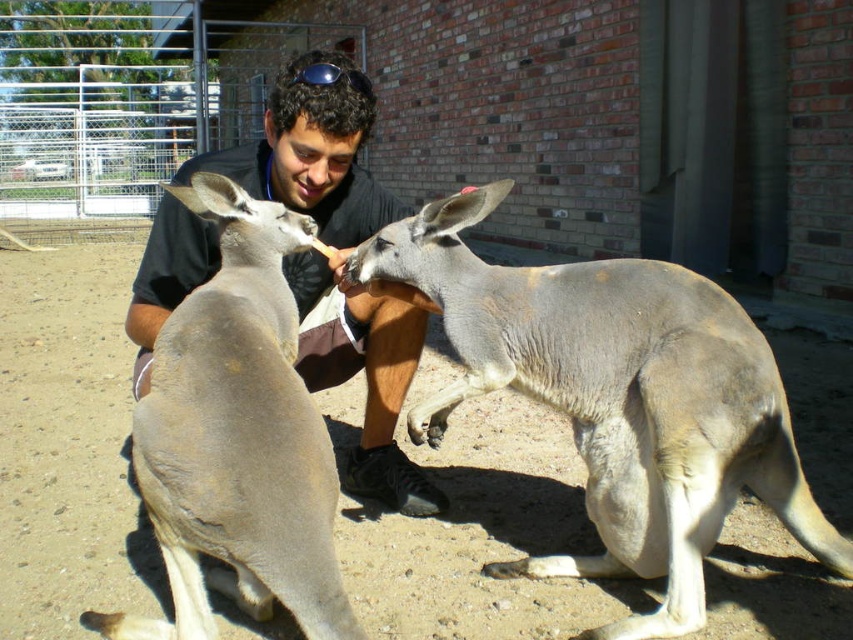
You are a wildlife photographer trying to capture a photo of both the gray fur kangaroo at center and the gray matte kangaroo at center. Your camera has a focus range that can cover 60 centimeters. Can you fit both kangaroos into the same frame without moving the camera?

The distance between the gray fur kangaroo at center and the gray matte kangaroo at center is 59.04 centimeters, which is within the camera focus range of 60 centimeters. Therefore, you can fit both kangaroos into the same frame without moving the camera.

You are standing at the point marked by the coordinates point (616, 397). Looking around, you see a gray fur kangaroo at center. What is the direction of the gray fur kangaroo at center relative to your current position?

A: The gray fur kangaroo at center is directly in front of you because the point marks its location at the center of the scene.

You are standing in front of the enclosure and want to take a photo of the smooth black shirt at center and the gray matte kangaroo at center. Which object should you focus on first if you want to capture both in focus without moving the camera?

To capture both the smooth black shirt at center and the gray matte kangaroo at center in focus, you should focus on the smooth black shirt at center first since it is closer to the camera than the gray matte kangaroo at center.